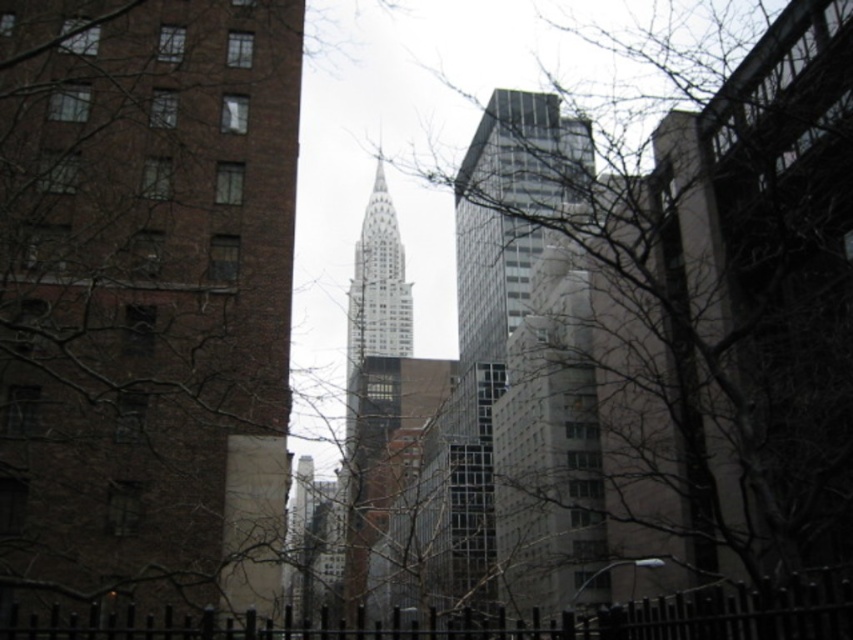
Question: From the image, what is the correct spatial relationship of bare branches at center in relation to glassy steel skyscraper at center?

Choices:
 (A) below
 (B) above

Answer: (B)

Question: Is glassy steel skyscraper at center positioned before white glass tower at center?

Choices:
 (A) yes
 (B) no

Answer: (A)

Question: Which object appears closest to the camera in this image?

Choices:
 (A) bare branches at center
 (B) glassy steel skyscraper at center

Answer: (A)

Question: Which of the following is the farthest from the observer?

Choices:
 (A) glassy steel skyscraper at center
 (B) bare branches at center

Answer: (A)

Question: Is glassy steel skyscraper at center behind white glass tower at center?

Choices:
 (A) no
 (B) yes

Answer: (A)

Question: Based on their relative distances, which object is nearer to the glassy steel skyscraper at center?

Choices:
 (A) bare branches at center
 (B) white glass tower at center

Answer: (A)